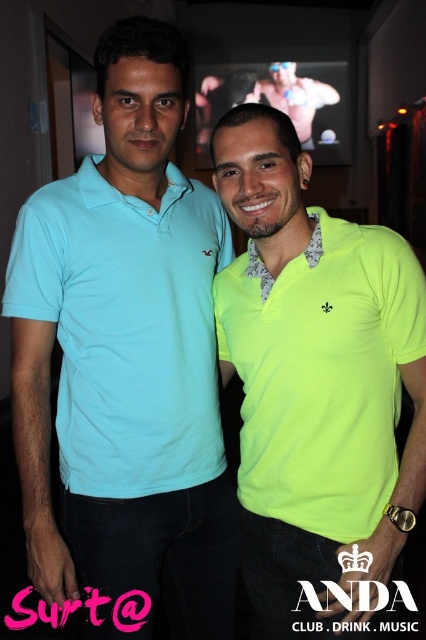
Does point (127, 312) lie in front of point (285, 92)?

Yes.

Does matte light blue polo shirt at left have a greater height compared to muscular skin at upper center?

Correct, matte light blue polo shirt at left is much taller as muscular skin at upper center.

Is point (51, 540) positioned behind point (267, 97)?

No, it is not.

Locate an element on the screen. matte light blue polo shirt at left is located at coordinates (126, 362).

Between neon yellow polo shirt at center and muscular skin at upper center, which one appears on the right side from the viewer's perspective?

From the viewer's perspective, muscular skin at upper center appears more on the right side.

At what (x,y) coordinates should I click in order to perform the action: click on neon yellow polo shirt at center. Please return your answer as a coordinate pair (x, y). This screenshot has width=426, height=640. Looking at the image, I should click on (316, 385).

The image size is (426, 640). I want to click on neon yellow polo shirt at center, so click(316, 385).

Can you confirm if matte light blue polo shirt at left is wider than neon yellow polo shirt at center?

Correct, the width of matte light blue polo shirt at left exceeds that of neon yellow polo shirt at center.

Between matte light blue polo shirt at left and neon yellow polo shirt at center, which one appears on the right side from the viewer's perspective?

From the viewer's perspective, neon yellow polo shirt at center appears more on the right side.

Which is in front, point (31, 467) or point (316, 257)?

Point (316, 257) is in front.

Find the location of `matte light blue polo shirt at left`. matte light blue polo shirt at left is located at coordinates (126, 362).